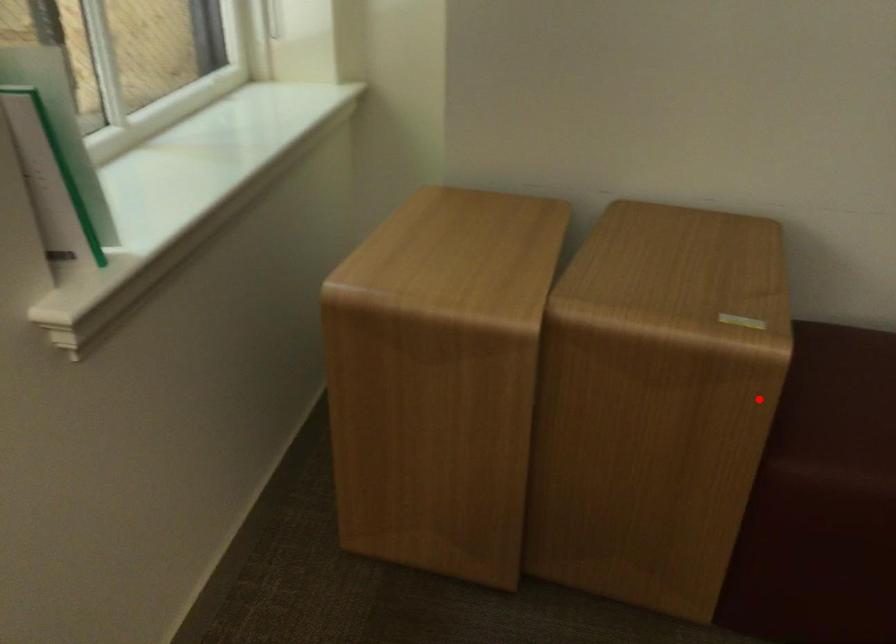
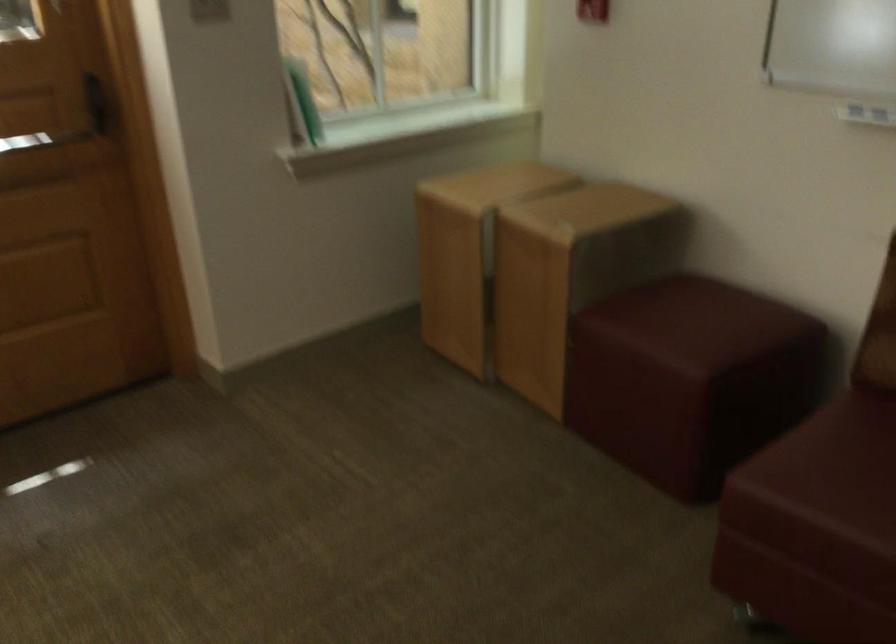
Question: I am providing you with two images of the same scene from different viewpoints. A red point is shown in image1. For the corresponding object point in image2, is it positioned nearer or farther from the camera?

Choices:
 (A) Nearer
 (B) Farther

Answer: (B)